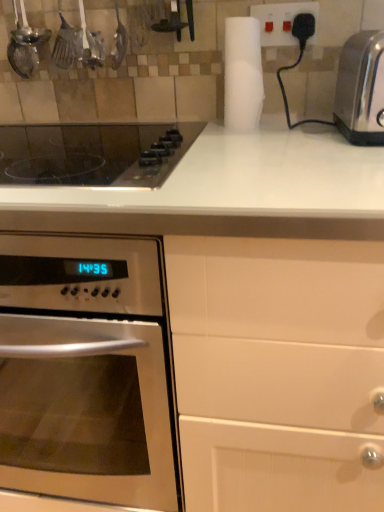
Question: In terms of height, does white plastic plug at upper right look taller or shorter compared to white matte paper towel at upper center?

Choices:
 (A) short
 (B) tall

Answer: (A)

Question: From the image's perspective, relative to white matte paper towel at upper center, is white plastic plug at upper right above or below?

Choices:
 (A) below
 (B) above

Answer: (B)

Question: Which object is the farthest from the white plastic plug at upper right?

Choices:
 (A) black glass cooktop at upper left
 (B) satin silver toaster at right
 (C) white matte paper towel at upper center
 (D) satin silver oven at left

Answer: (D)

Question: Estimate the real-world distances between objects in this image. Which object is closer to the white matte paper towel at upper center?

Choices:
 (A) satin silver toaster at right
 (B) white plastic plug at upper right
 (C) satin silver oven at left
 (D) black glass cooktop at upper left

Answer: (B)